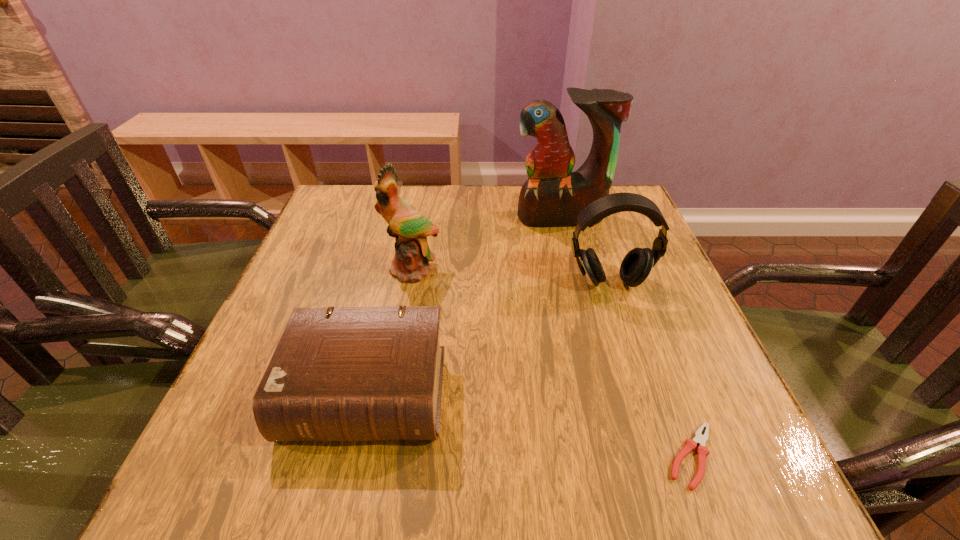
You are a GUI agent. You are given a task and a screenshot of the screen. Output one action in this format:
    pyautogui.click(x=<x>, y=<y>)
    Task: Click on the free region located on the back of the shortest object
    Image resolution: width=960 pixels, height=540 pixels.
    Given the screenshot: What is the action you would take?
    pyautogui.click(x=641, y=322)

This screenshot has height=540, width=960. In order to click on object that is at the far edge in this screenshot , I will do `click(553, 195)`.

Find the location of `Bible situated at the near edge`. Bible situated at the near edge is located at coordinates (350, 373).

Where is `pliers present at the near edge`? Image resolution: width=960 pixels, height=540 pixels. pliers present at the near edge is located at coordinates (690, 444).

You are a GUI agent. You are given a task and a screenshot of the screen. Output one action in this format:
    pyautogui.click(x=<x>, y=<y>)
    Task: Click on the object that is at the left edge
    This screenshot has height=540, width=960.
    Given the screenshot: What is the action you would take?
    pyautogui.click(x=350, y=373)

Where is `parrot that is at the right edge`? The image size is (960, 540). parrot that is at the right edge is located at coordinates (553, 195).

The width and height of the screenshot is (960, 540). Find the location of `earphone present at the right edge`. earphone present at the right edge is located at coordinates (636, 266).

Find the location of `pliers that is at the right edge`. pliers that is at the right edge is located at coordinates (690, 444).

Identify the location of object at the near left corner. Image resolution: width=960 pixels, height=540 pixels. [x=350, y=373].

You are a GUI agent. You are given a task and a screenshot of the screen. Output one action in this format:
    pyautogui.click(x=<x>, y=<y>)
    Task: Click on the object that is positioned at the far right corner
    This screenshot has width=960, height=540.
    Given the screenshot: What is the action you would take?
    pyautogui.click(x=553, y=195)